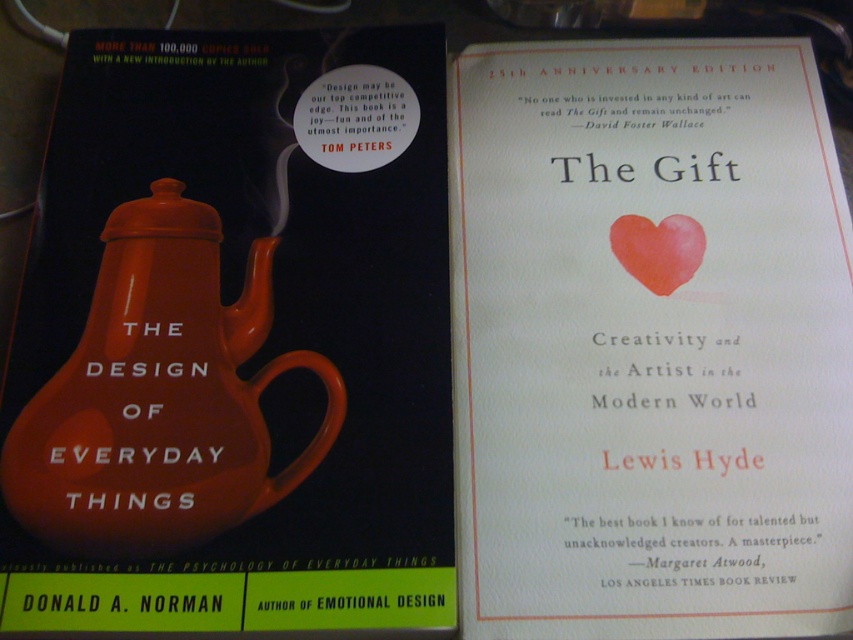
Is point (584, 524) less distant than point (102, 436)?

Yes.

Does matte paper cover at center have a lesser height compared to matte ceramic teapot at left?

Incorrect, matte paper cover at center's height does not fall short of matte ceramic teapot at left's.

Between point (833, 202) and point (218, 506), which one is positioned in front?

Point (218, 506) is more forward.

In order to click on matte paper cover at center in this screenshot , I will do `click(650, 344)`.

Is point (113, 554) in front of point (91, 339)?

Yes, it is in front of point (91, 339).

Does point (328, 52) come closer to viewer compared to point (221, 401)?

That is False.

In order to click on matte ceramic teapot at center in this screenshot , I will do `click(234, 340)`.

Who is positioned more to the right, matte paper cover at center or watercolor paper heart at center?

Positioned to the right is watercolor paper heart at center.

Between point (723, 179) and point (672, 243), which one is positioned in front?

Point (672, 243) is in front.

Where is `matte paper cover at center`? The image size is (853, 640). matte paper cover at center is located at coordinates (650, 344).